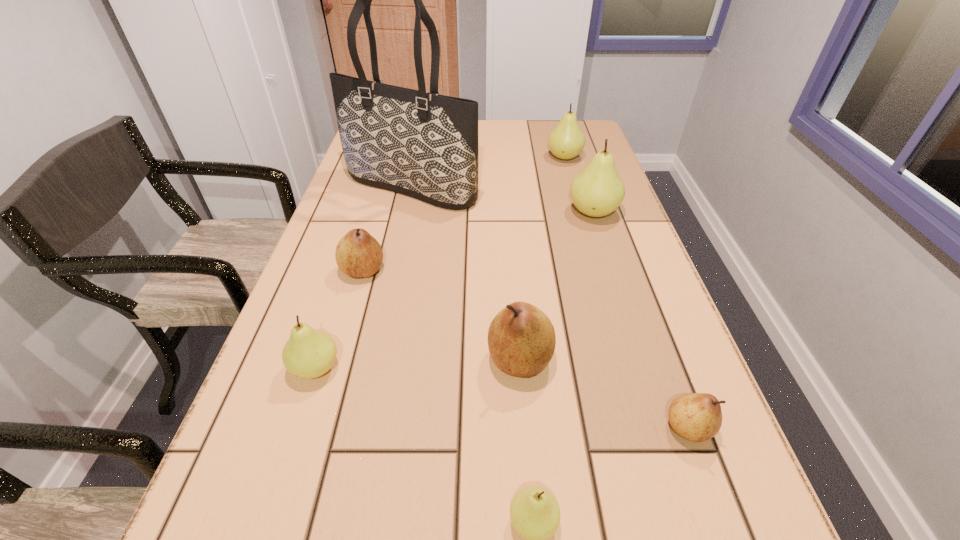
Identify the location of black tote bag. (422, 144).

Identify the location of the tallest object. (422, 144).

Image resolution: width=960 pixels, height=540 pixels. In order to click on the second tallest object in this screenshot , I will do `click(597, 191)`.

You are a GUI agent. You are given a task and a screenshot of the screen. Output one action in this format:
    pyautogui.click(x=<x>, y=<y>)
    Task: Click on the tallest pear
    
    Given the screenshot: What is the action you would take?
    pyautogui.click(x=597, y=191)

Image resolution: width=960 pixels, height=540 pixels. I want to click on the farthest green pear, so click(566, 140).

Image resolution: width=960 pixels, height=540 pixels. I want to click on the farthest object, so click(566, 140).

Locate an element on the screen. Image resolution: width=960 pixels, height=540 pixels. the second farthest brown pear is located at coordinates (x=521, y=338).

This screenshot has height=540, width=960. I want to click on the biggest brown pear, so click(x=521, y=338).

What are the coordinates of `the second nearest green pear` in the screenshot? It's located at (309, 353).

The height and width of the screenshot is (540, 960). Identify the location of the leftmost green pear. (309, 353).